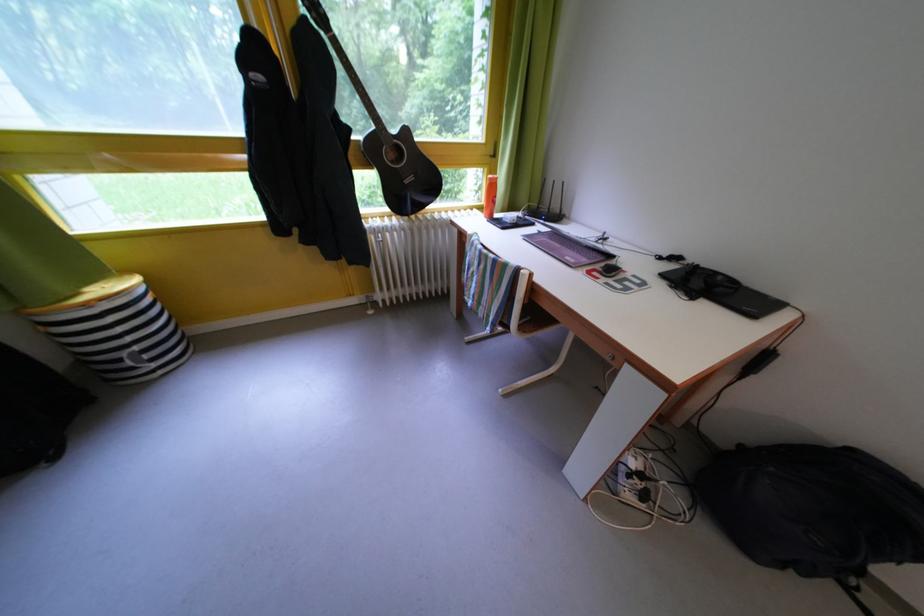
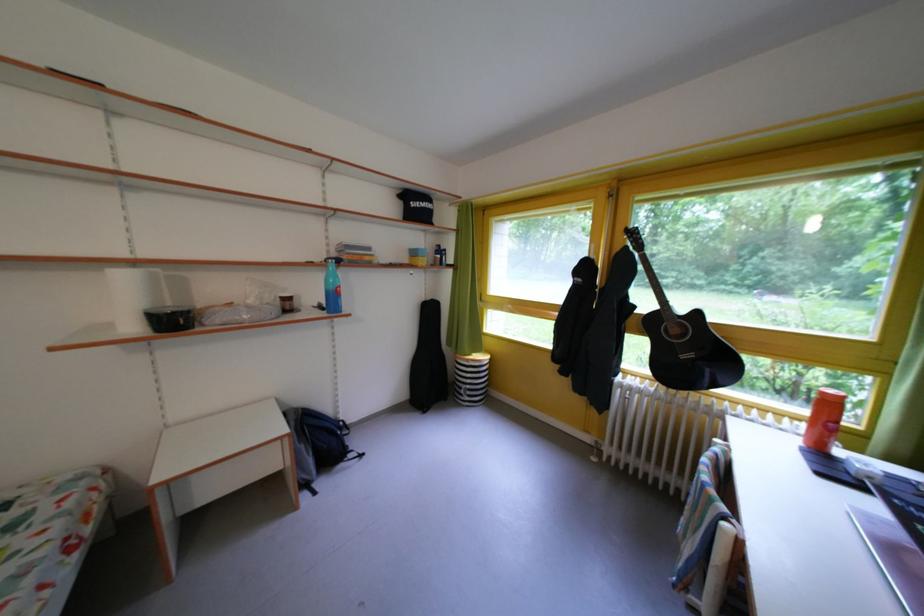
The point at (417,187) is marked in the first image. Where is the corresponding point in the second image?

(693, 362)